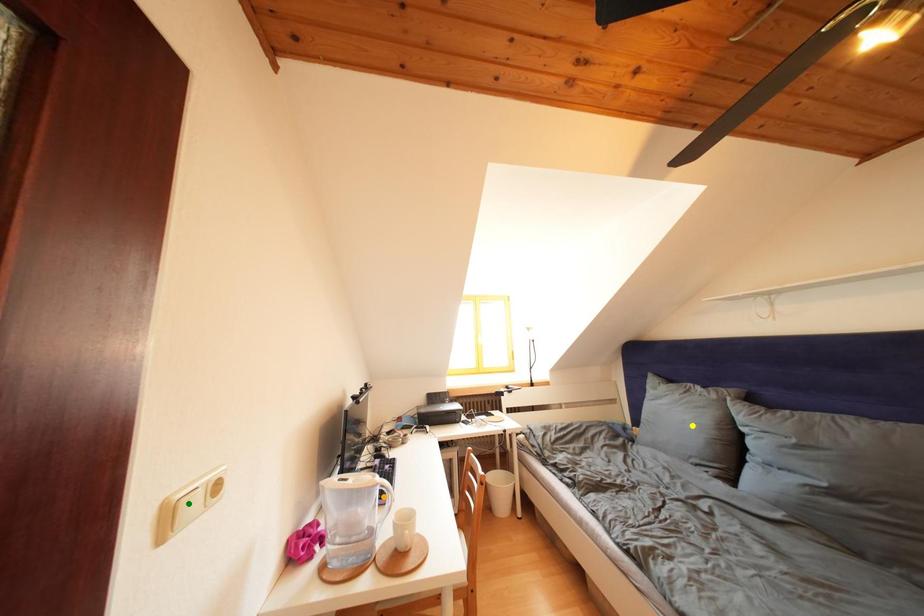
Order these from nearest to farthest:
A) yellow point
B) green point
C) orange point

green point
orange point
yellow point